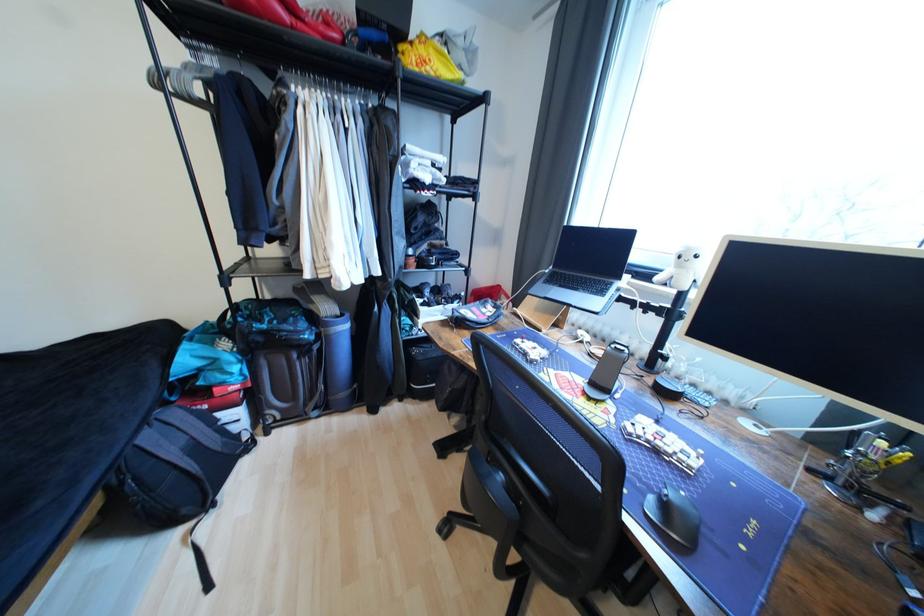
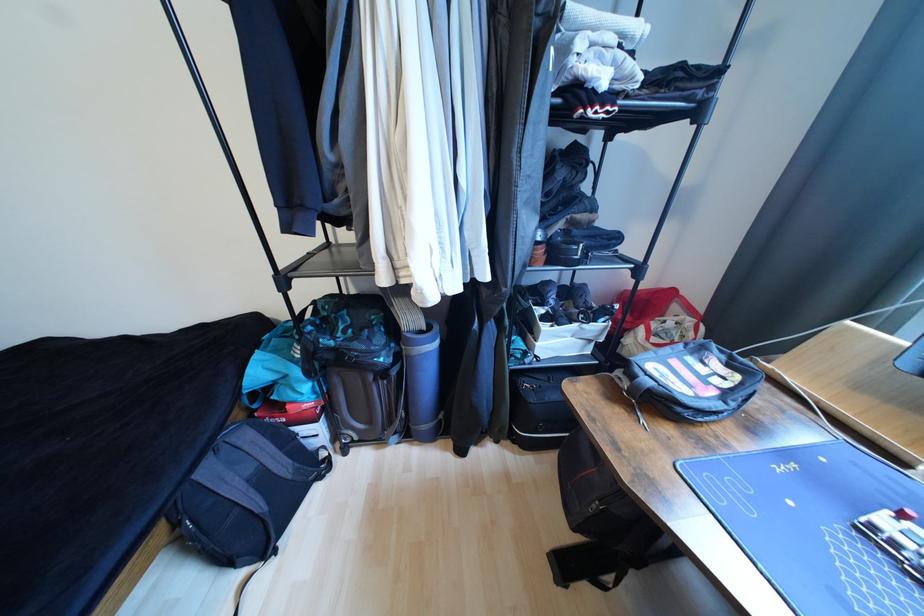
The point at (155, 439) is marked in the first image. Where is the corresponding point in the second image?

(215, 472)